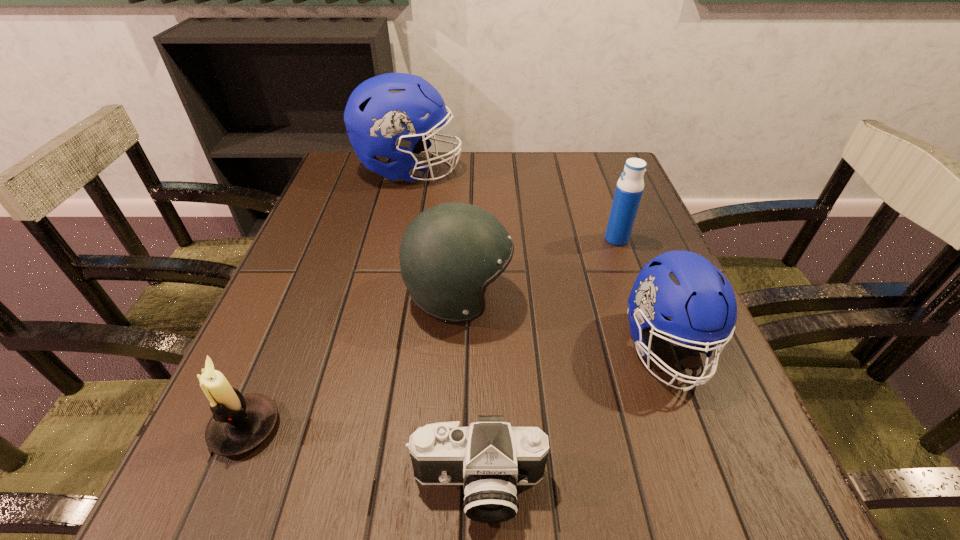
You are a GUI agent. You are given a task and a screenshot of the screen. Output one action in this format:
    pyautogui.click(x=<x>, y=<y>)
    Task: Click on the free region at the far edge of the desktop
    Image resolution: width=960 pixels, height=540 pixels.
    Given the screenshot: What is the action you would take?
    pyautogui.click(x=489, y=181)

You are a GUI agent. You are given a task and a screenshot of the screen. Output one action in this format:
    pyautogui.click(x=<x>, y=<y>)
    Task: Click on the free space at the near edge of the desktop
    
    Given the screenshot: What is the action you would take?
    pyautogui.click(x=377, y=509)

Identify the location of free space at the left edge of the desktop. This screenshot has width=960, height=540. (280, 281).

In the image, there is a desktop. Find the location of `vacant space at the right edge`. vacant space at the right edge is located at coordinates (625, 306).

Locate an element on the screen. This screenshot has height=540, width=960. vacant space at the far right corner of the desktop is located at coordinates (584, 164).

The width and height of the screenshot is (960, 540). In order to click on vacant region at the near right corner in this screenshot , I will do click(x=696, y=501).

Identify the location of unoccupied position between the farthest football helmet and the candle holder. The image size is (960, 540). (327, 299).

You are a GUI agent. You are given a task and a screenshot of the screen. Output one action in this format:
    pyautogui.click(x=<x>, y=<y>)
    Task: Click on the vacant space that's between the shortest object and the rightmost football helmet
    The height and width of the screenshot is (540, 960).
    Given the screenshot: What is the action you would take?
    pyautogui.click(x=572, y=417)

Where is `vacant region between the rightmost football helmet and the candle holder`? This screenshot has height=540, width=960. vacant region between the rightmost football helmet and the candle holder is located at coordinates (456, 388).

Find the location of `free space between the candle holder and the shortest object`. free space between the candle holder and the shortest object is located at coordinates (362, 457).